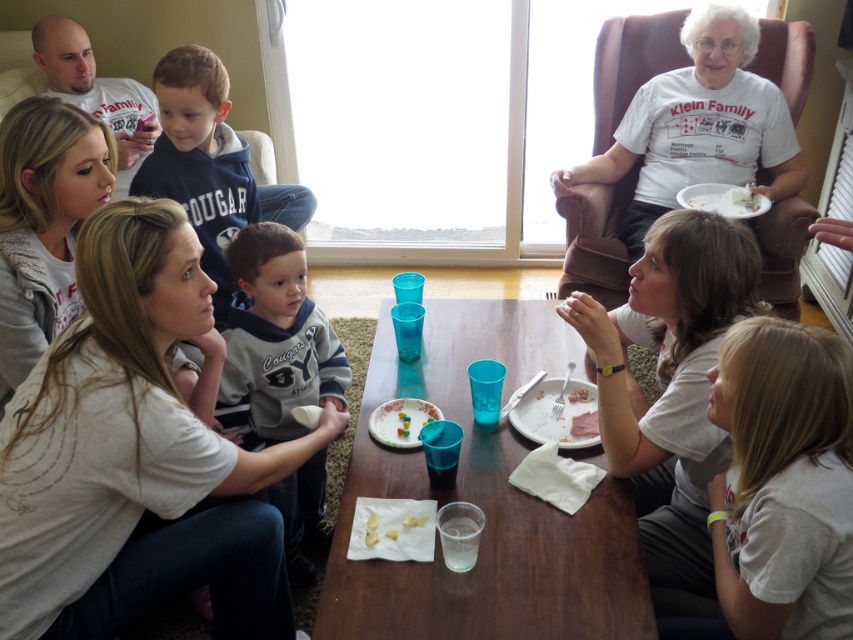
Question: Is white cotton shirt at lower right to the left of yellow crumbly food at center from the viewer's perspective?

Choices:
 (A) yes
 (B) no

Answer: (B)

Question: Can you confirm if white cotton shirt at upper left is wider than smooth white plate at lower center?

Choices:
 (A) yes
 (B) no

Answer: (A)

Question: Among these points, which one is farthest from the camera?

Choices:
 (A) (587, 420)
 (B) (585, 388)
 (C) (193, 131)
 (D) (379, 404)

Answer: (C)

Question: Among these objects, which one is farthest from the camera?

Choices:
 (A) smooth wooden table at center
 (B) yellow crumbly food at center

Answer: (B)

Question: Which is nearer to the white cotton shirt at upper left?

Choices:
 (A) smooth white plate at lower center
 (B) white matte plate at upper right
 (C) dark blue hoodie at upper left

Answer: (C)

Question: Is dark blue hoodie at upper left to the right of white matte plate at upper right from the viewer's perspective?

Choices:
 (A) yes
 (B) no

Answer: (B)